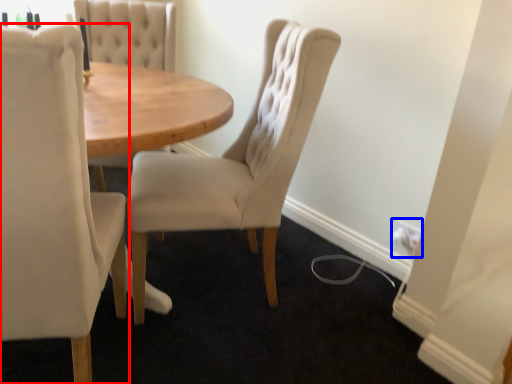
Question: Which point is closer to the camera, chair (highlighted by a red box) or electric outlet (highlighted by a blue box)?

Choices:
 (A) chair
 (B) electric outlet

Answer: (A)